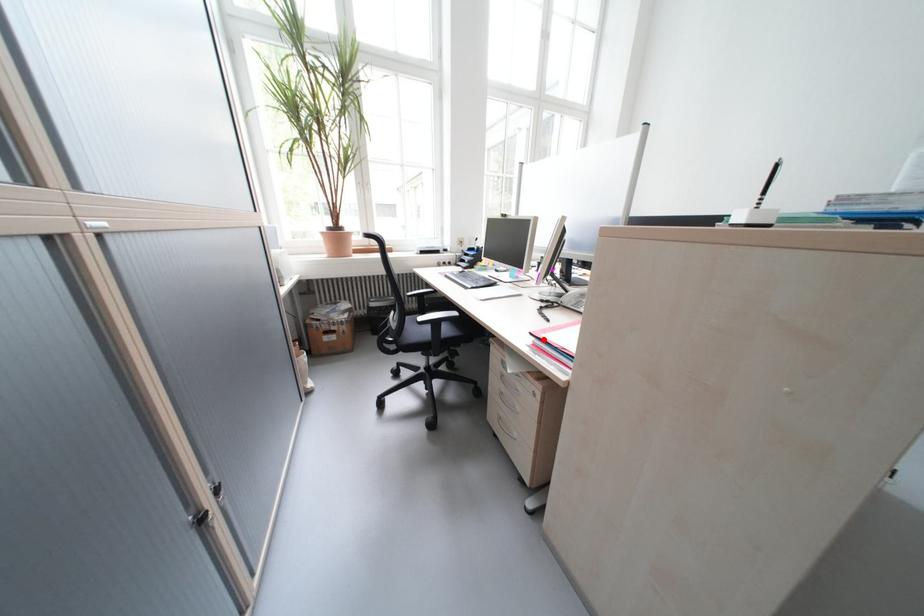
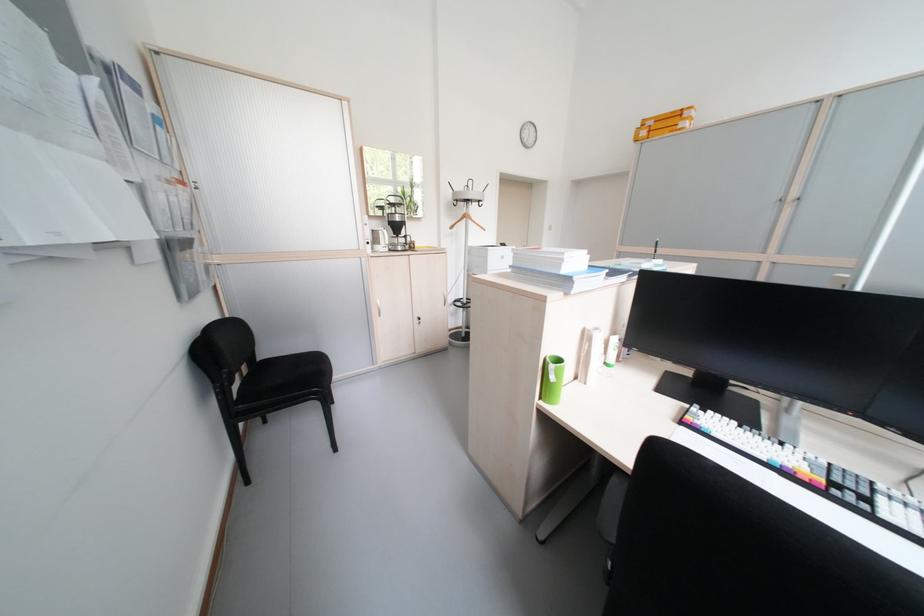
Question: I am providing you with two images of the same scene from different viewpoints. A red point is marked on the first image. Can you still see the location of the red point in image 2?

Choices:
 (A) Yes
 (B) No

Answer: (B)